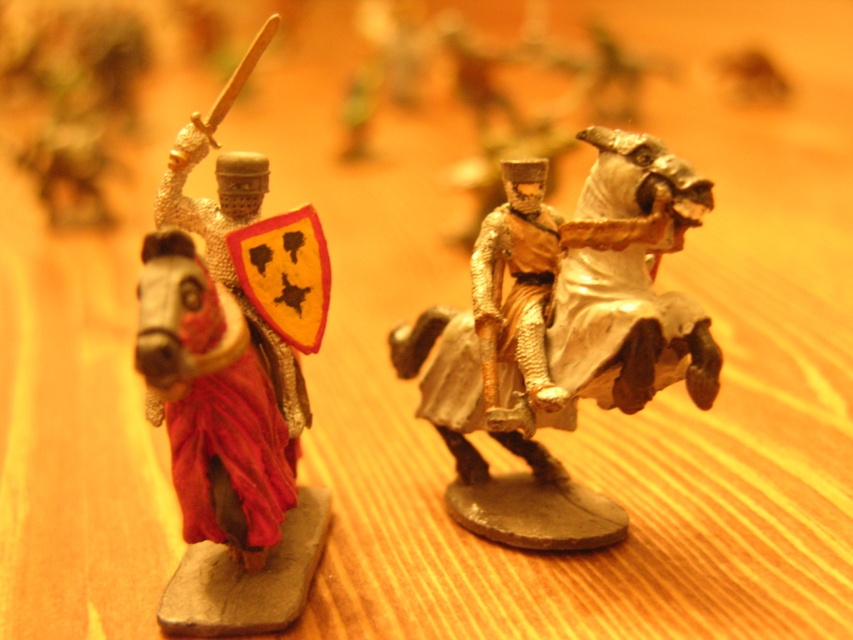
Question: Which point appears closest to the camera in this image?

Choices:
 (A) [x=267, y=552]
 (B) [x=654, y=164]

Answer: (B)

Question: Which point is closer to the camera?

Choices:
 (A) (305, 314)
 (B) (471, 401)

Answer: (A)

Question: Is metallic silver horse at left positioned before gold metallic horse at center?

Choices:
 (A) no
 (B) yes

Answer: (B)

Question: Is metallic silver horse at left wider than gold metallic horse at center?

Choices:
 (A) yes
 (B) no

Answer: (B)

Question: Does metallic silver horse at left have a lesser width compared to gold metallic horse at center?

Choices:
 (A) yes
 (B) no

Answer: (A)